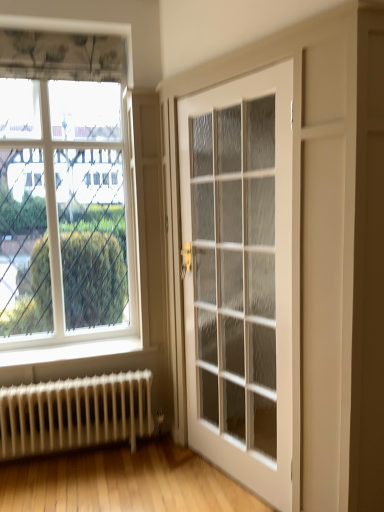
Locate an element on the screen. Image resolution: width=384 pixels, height=512 pixels. vacant area to the right of white metal radiator at lower left is located at coordinates (157, 475).